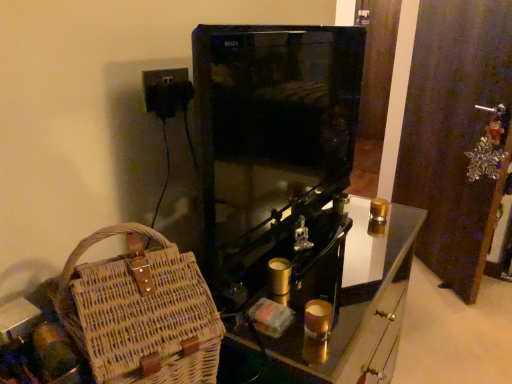
Where is `woven straw bag at lower left`? woven straw bag at lower left is located at coordinates (140, 312).

This screenshot has width=512, height=384. What do you see at coordinates (347, 303) in the screenshot? I see `woven wood basket at lower left` at bounding box center [347, 303].

Identify the location of metallic brown door at right. This screenshot has height=384, width=512. (453, 133).

The width and height of the screenshot is (512, 384). Find the location of `woven straw bag at lower left`. woven straw bag at lower left is located at coordinates click(x=140, y=312).

Is woven wood basket at lower left to the left of metallic brown door at right from the viewer's perspective?

Yes, woven wood basket at lower left is to the left of metallic brown door at right.

Who is shorter, woven wood basket at lower left or metallic brown door at right?

woven wood basket at lower left.

From the picture: How different are the orientations of woven wood basket at lower left and metallic brown door at right in degrees?

There is a 138-degree angle between the facing directions of woven wood basket at lower left and metallic brown door at right.

Looking at their sizes, would you say woven wood basket at lower left is wider or thinner than metallic brown door at right?

woven wood basket at lower left is wider than metallic brown door at right.

Looking at their sizes, would you say woven wood basket at lower left is wider or thinner than woven straw bag at lower left?

Clearly, woven wood basket at lower left has more width compared to woven straw bag at lower left.

Could you tell me if woven wood basket at lower left is facing woven straw bag at lower left?

No.

Which is nearer, (372,247) or (183,274)?

Point (372,247) is farther from the camera than point (183,274).

From the image's perspective, is woven wood basket at lower left positioned above or below woven straw bag at lower left?

Based on their image positions, woven wood basket at lower left is located beneath woven straw bag at lower left.

Looking at this image, which of these two, metallic brown door at right or woven straw bag at lower left, is wider?

woven straw bag at lower left.

Is metallic brown door at right positioned before woven straw bag at lower left?

No, metallic brown door at right is further to the viewer.

Is metallic brown door at right next to woven straw bag at lower left and touching it?

No, metallic brown door at right is not touching woven straw bag at lower left.

From the image's perspective, is metallic brown door at right above or below woven straw bag at lower left?

Based on their image positions, metallic brown door at right is located above woven straw bag at lower left.

Would you say metallic brown door at right is a long distance from woven wood basket at lower left?

Absolutely, metallic brown door at right is distant from woven wood basket at lower left.

Which object is closer to the camera taking this photo, metallic brown door at right or woven wood basket at lower left?

woven wood basket at lower left.

How many degrees apart are the facing directions of metallic brown door at right and woven wood basket at lower left?

138 degrees.

From a real-world perspective, which object rests below the other?

woven wood basket at lower left, from a real-world perspective.

Is woven straw bag at lower left directly adjacent to woven wood basket at lower left?

No, woven straw bag at lower left is not beside woven wood basket at lower left.

From the image's perspective, is woven straw bag at lower left located above or below woven wood basket at lower left?

woven straw bag at lower left is above woven wood basket at lower left.

Is woven straw bag at lower left turned away from metallic brown door at right?

That's not correct — woven straw bag at lower left is not looking away from metallic brown door at right.

How different are the orientations of woven straw bag at lower left and metallic brown door at right in degrees?

The facing directions of woven straw bag at lower left and metallic brown door at right are 115 degrees apart.

In the scene shown: From a real-world perspective, is woven straw bag at lower left physically below metallic brown door at right?

No, from a real-world perspective, woven straw bag at lower left is not under metallic brown door at right.

Which is behind, point (118, 383) or point (421, 44)?

The point (421, 44) is farther.

Where is `door on the right side of woven wood basket at lower left`? The width and height of the screenshot is (512, 384). door on the right side of woven wood basket at lower left is located at coordinates (453, 133).

Locate an element on the screen. handbag in front of the woven wood basket at lower left is located at coordinates (140, 312).

When comparing their distances from woven wood basket at lower left, does metallic brown door at right or woven straw bag at lower left seem closer?

woven straw bag at lower left.

Which object lies nearer to the anchor point woven straw bag at lower left, woven wood basket at lower left or metallic brown door at right?

Among the two, woven wood basket at lower left is located nearer to woven straw bag at lower left.

From the image, which object appears to be nearer to metallic brown door at right, woven straw bag at lower left or woven wood basket at lower left?

woven wood basket at lower left lies closer to metallic brown door at right than the other object.

Considering their positions, is metallic brown door at right positioned further to woven straw bag at lower left than woven wood basket at lower left?

The object further to woven straw bag at lower left is metallic brown door at right.

Looking at the image, which one is located closer to woven wood basket at lower left, woven straw bag at lower left or metallic brown door at right?

woven straw bag at lower left.

From the image, which object appears to be nearer to metallic brown door at right, woven wood basket at lower left or woven straw bag at lower left?

woven wood basket at lower left.

At what (x,y) coordinates should I click in order to perform the action: click on furniture situated between woven straw bag at lower left and metallic brown door at right from left to right. Please return your answer as a coordinate pair (x, y). The height and width of the screenshot is (384, 512). Looking at the image, I should click on (347, 303).